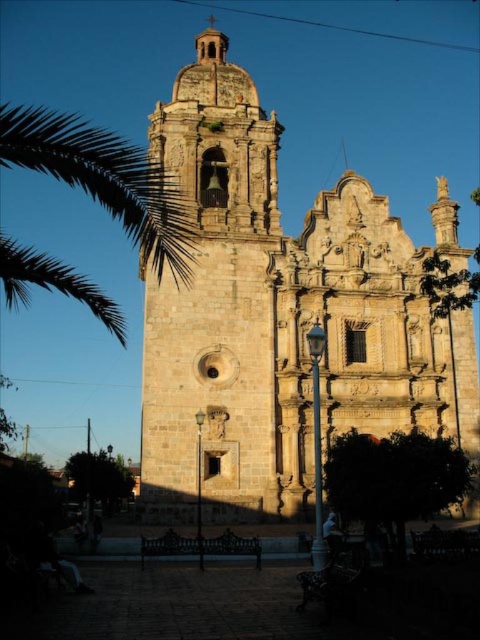
Based on the photo, does stone tower at center have a lesser width compared to green leafy palm at left?

Yes.

Who is lower down, stone tower at center or green leafy palm at left?

stone tower at center is below.

Identify the location of stone tower at center. (216, 300).

The image size is (480, 640). What are the coordinates of `stone tower at center` in the screenshot? It's located at pos(216,300).

From the picture: Who is more distant from viewer, (338,252) or (164,227)?

Positioned behind is point (338,252).

Who is taller, stone church at center or green leafy palm at left?

Standing taller between the two is stone church at center.

At what (x,y) coordinates should I click in order to perform the action: click on stone church at center. Please return your answer as a coordinate pair (x, y). This screenshot has height=640, width=480. Looking at the image, I should click on (279, 317).

Which of these two, stone church at center or stone tower at center, stands shorter?

With less height is stone tower at center.

Is stone church at center to the right of stone tower at center from the viewer's perspective?

Yes, stone church at center is to the right of stone tower at center.

Which is behind, point (233, 477) or point (219, 115)?

Point (219, 115)

You are a GUI agent. You are given a task and a screenshot of the screen. Output one action in this format:
    pyautogui.click(x=<x>, y=<y>)
    Task: Click on the stone church at center
    This screenshot has width=480, height=640.
    Given the screenshot: What is the action you would take?
    pyautogui.click(x=279, y=317)